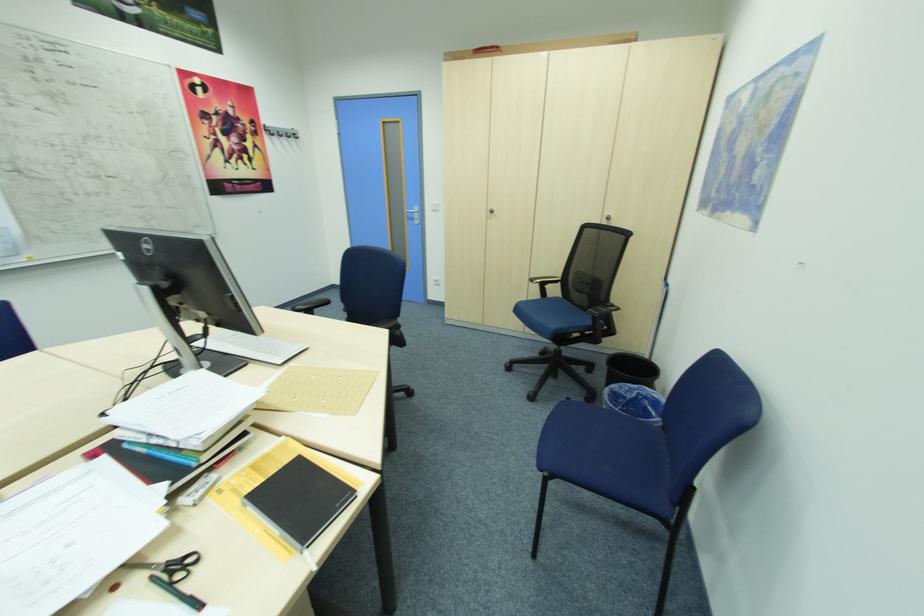
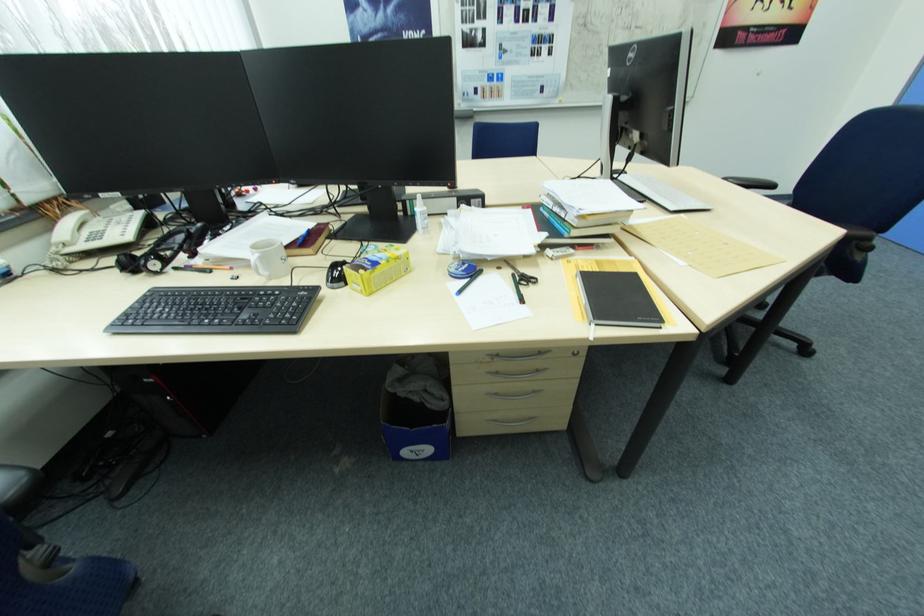
The first image is from the beginning of the video and the second image is from the end. How did the camera likely rotate when shooting the video?

The camera's rotation is toward left-down.